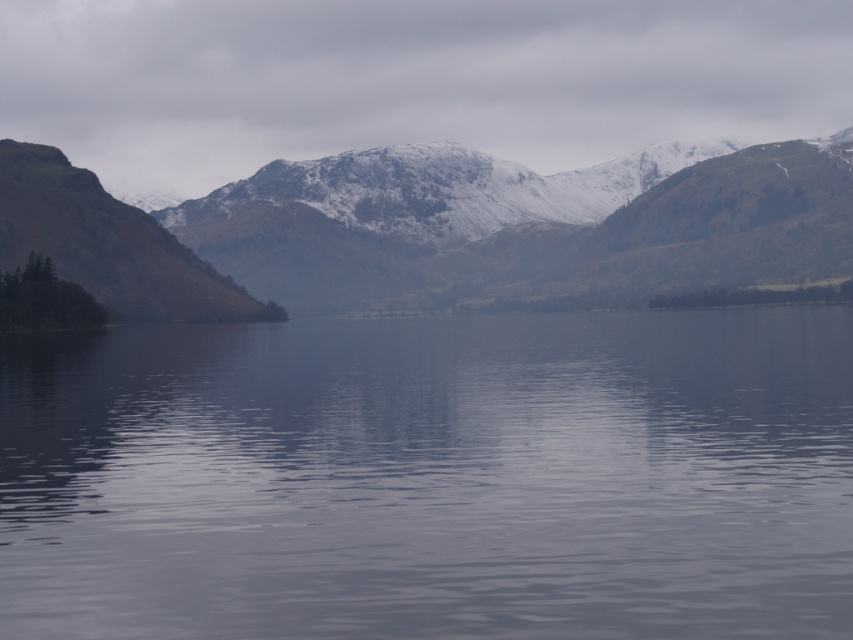
Question: Does smooth gray water at center appear on the left side of snow-covered mountain at upper center?

Choices:
 (A) yes
 (B) no

Answer: (A)

Question: Among these objects, which one is farthest from the camera?

Choices:
 (A) smooth gray water at center
 (B) snow-covered mountain at upper center

Answer: (B)

Question: Does smooth gray water at center appear on the left side of snow-covered mountain at upper center?

Choices:
 (A) yes
 (B) no

Answer: (A)

Question: Does smooth gray water at center have a smaller size compared to snow-covered mountain at upper center?

Choices:
 (A) yes
 (B) no

Answer: (B)

Question: Which object is closer to the camera taking this photo?

Choices:
 (A) smooth gray water at center
 (B) snow-covered mountain at upper center

Answer: (A)

Question: Which point appears farthest from the camera in this image?

Choices:
 (A) (219, 493)
 (B) (445, 157)

Answer: (B)